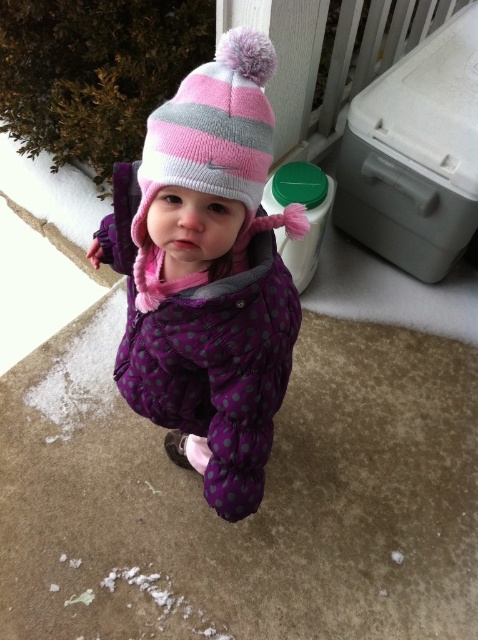
Question: Can you confirm if purple quilted jacket at center is bigger than pink striped knit hat at upper center?

Choices:
 (A) yes
 (B) no

Answer: (A)

Question: Which object is farther from the camera taking this photo?

Choices:
 (A) white plastic cooler at upper right
 (B) pink striped knit hat at upper center

Answer: (A)

Question: Among these points, which one is farthest from the camera?

Choices:
 (A) (209, 138)
 (B) (271, 278)
 (C) (468, 8)

Answer: (C)

Question: Which is farther from the purple quilted jacket at center?

Choices:
 (A) pink striped knit hat at upper center
 (B) white plastic cooler at upper right

Answer: (B)

Question: Can you confirm if purple quilted jacket at center is positioned below white plastic cooler at upper right?

Choices:
 (A) yes
 (B) no

Answer: (A)

Question: Does white plastic cooler at upper right appear under pink striped knit hat at upper center?

Choices:
 (A) yes
 (B) no

Answer: (B)